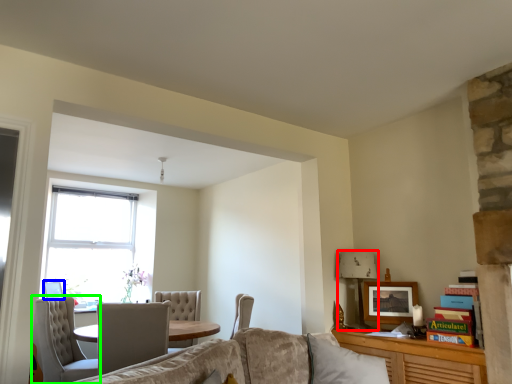
Question: Which object is the closest to the lamp (highlighted by a red box)? Choose among these: picture frame (highlighted by a blue box) or chair (highlighted by a green box).

Choices:
 (A) picture frame
 (B) chair

Answer: (B)